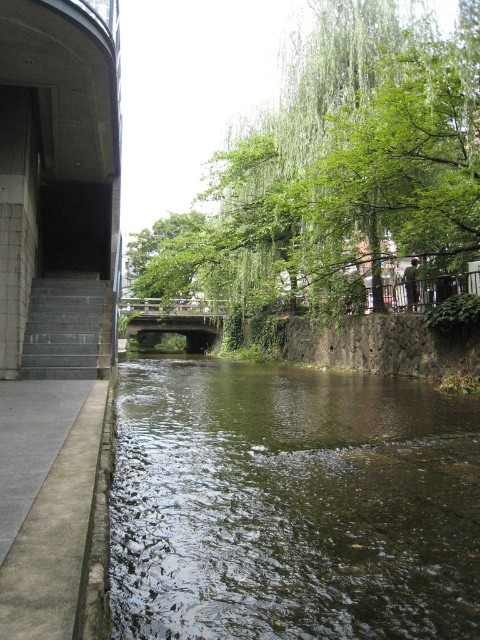
You are a maintenance worker needing to inspect both the gray concrete stairs at left and the wooden bridge at center. Based on their positions, which structure is higher from the ground level?

The gray concrete stairs at left is above wooden bridge at center, so the gray concrete stairs at left is higher from the ground level.

You are a pedestrian trying to cross the wooden bridge at center. There is a green leafy tree at center blocking your path. Can you walk under the tree to get to the other side?

The green leafy tree at center is positioned over the wooden bridge at center, so you can walk under the tree to reach the other side.